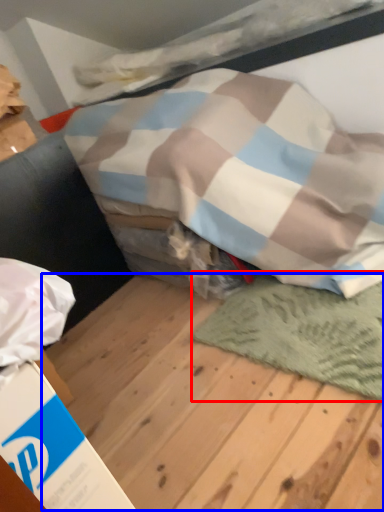
Question: Which point is closer to the camera, mat (highlighted by a red box) or plywood (highlighted by a blue box)?

Choices:
 (A) mat
 (B) plywood

Answer: (B)